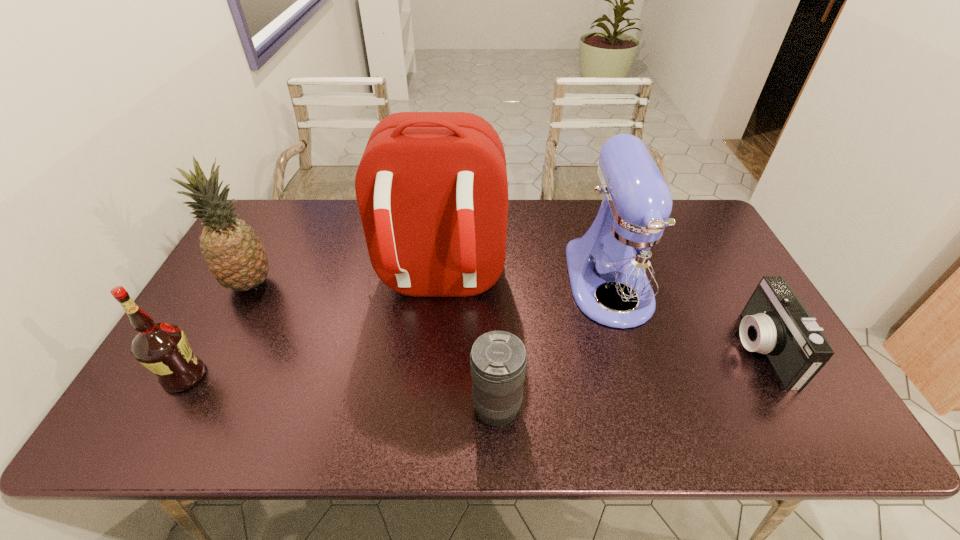
What are the coordinates of `free space between the pineapple and the alcohol` in the screenshot? It's located at (217, 330).

Find the location of a particular element. The height and width of the screenshot is (540, 960). free space between the rightmost object and the pineapple is located at coordinates (506, 316).

Image resolution: width=960 pixels, height=540 pixels. Find the location of `empty space that is in between the tallest object and the pineapple`. empty space that is in between the tallest object and the pineapple is located at coordinates pos(345,283).

The width and height of the screenshot is (960, 540). Find the location of `empty space that is in between the backpack and the mixer`. empty space that is in between the backpack and the mixer is located at coordinates (524, 283).

Where is `object that is the second closest one to the camcorder`? Image resolution: width=960 pixels, height=540 pixels. object that is the second closest one to the camcorder is located at coordinates 498,360.

Identify the location of object that can be found as the closest to the second shortest object. The width and height of the screenshot is (960, 540). (431, 187).

I want to click on free location that satisfies the following two spatial constraints: 1. at the mixing area of the mixer; 2. on the side of the fifth tallest object where the control switches are located, so click(x=646, y=408).